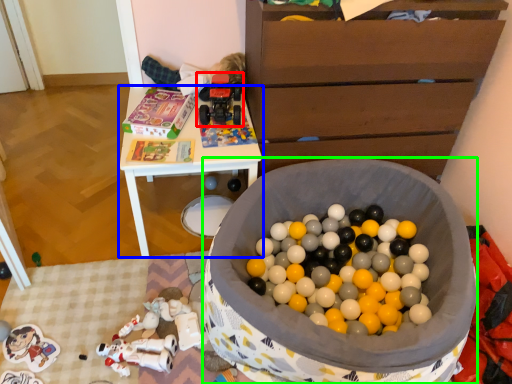
Question: Based on their relative distances, which object is nearer to toy (highlighted by a red box)? Choose from table (highlighted by a blue box) and toy (highlighted by a green box).

Choices:
 (A) table
 (B) toy

Answer: (A)